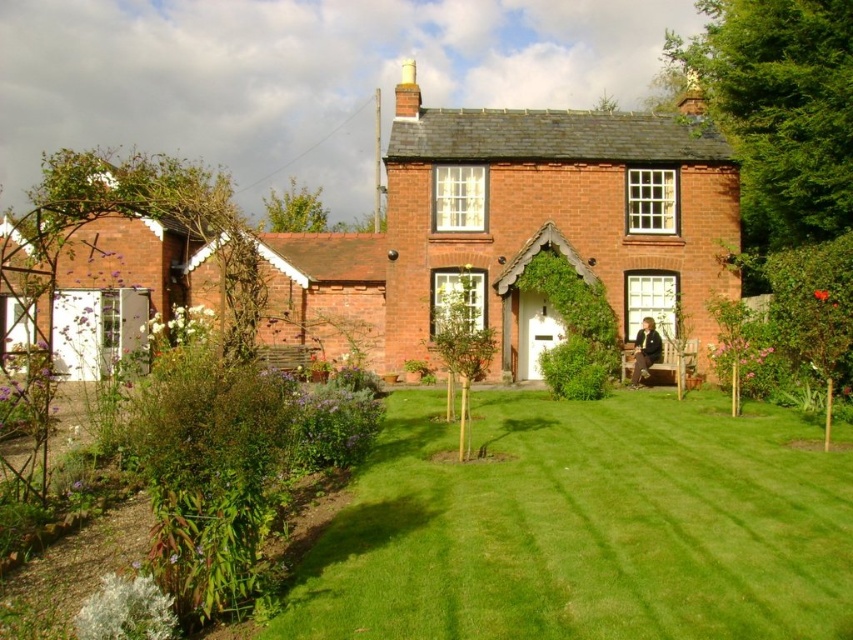
You are planning to install a new garden feature between the green smooth lawn at center and the red brick cottage at center. Which area has more space available for placement?

The red brick cottage at center has more space available because the green smooth lawn at center is thinner, meaning it is narrower or less wide than the cottage.

You are standing on the green smooth lawn at center and want to reach the red brick cottage at center. Which direction should you move to get closer to the cottage?

The green smooth lawn at center is below the red brick cottage at center, so you should move upward to get closer to the cottage.

You are standing in front of the house and want to take a photo. There are two points marked on the lawn where you can stand. The first point is at coordinates point (688, 602), and the second point is at coordinates point (363, 312). Which point should you choose if you want to be closer to the camera?

Point (688, 602) is closer to the camera than point (363, 312), so you should choose point (688, 602) to be closer to the camera.